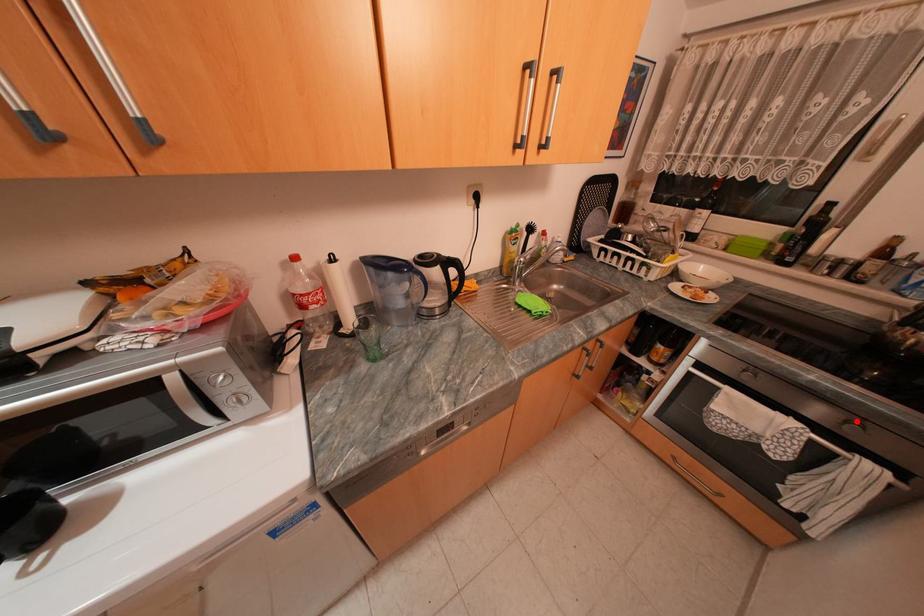
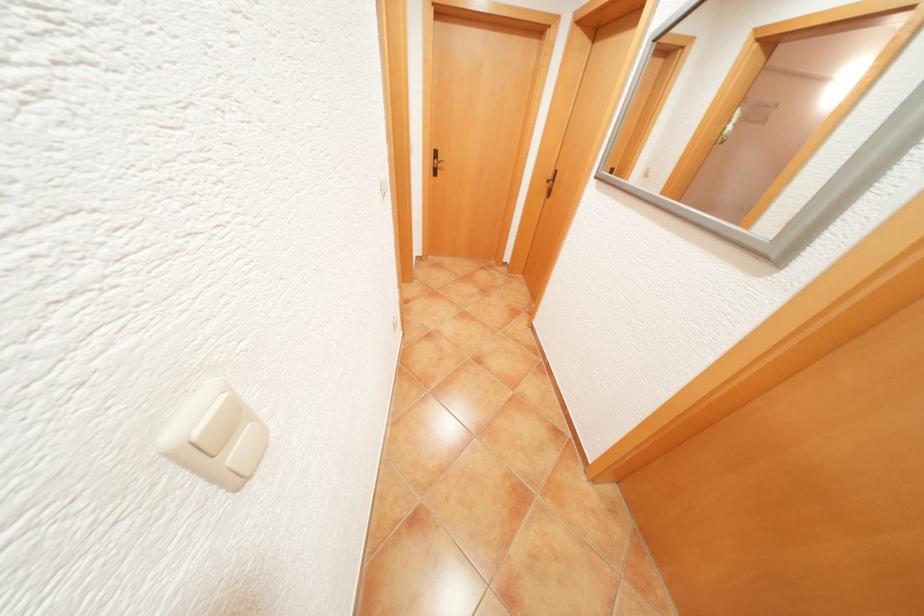
Question: I am providing you with two images of the same scene from different viewpoints. A red point is marked on the first image. Is the red point's position out of view in image 2?

Choices:
 (A) Yes
 (B) No

Answer: (A)